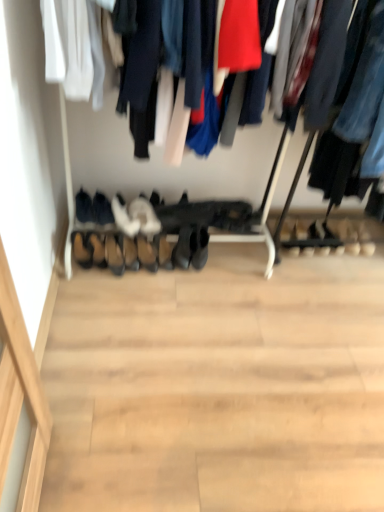
Question: Considering the positions of point (134, 249) and point (97, 260), is point (134, 249) closer or farther from the camera than point (97, 260)?

Choices:
 (A) farther
 (B) closer

Answer: (A)

Question: In terms of height, does leather shoes at center, the third shoe from the left, look taller or shorter compared to brown leather shoe at lower center, which is the third shoe in right-to-left order?

Choices:
 (A) short
 (B) tall

Answer: (B)

Question: Considering the real-world distances, which object is closest to the leather shoes at center, the 2th shoe positioned from the right?

Choices:
 (A) black suede shoes at center, which is the second footwear in left-to-right order
 (B) black suede shoes at lower left, positioned as the 1th footwear in left-to-right order
 (C) brown leather shoe at center, the 6th footwear viewed from the left
 (D) white suede shoes at center, which is the 2th footwear in right-to-left order
 (E) leather at center, the fourth shoe in the left-to-right sequence

Answer: (C)

Question: Considering the real-world distances, which object is farthest from the white suede shoes at center, which is the 2th footwear in right-to-left order?

Choices:
 (A) brown suede shoes at center, which is counted as the 4th footwear, starting from the right
 (B) leather at left, positioned as the fourth shoe in right-to-left order
 (C) leather at center, which ranks as the 1th shoe in right-to-left order
 (D) brown leather shoe at center, the 6th footwear viewed from the left
 (E) black suede shoes at lower left, which is counted as the 6th footwear, starting from the right

Answer: (B)